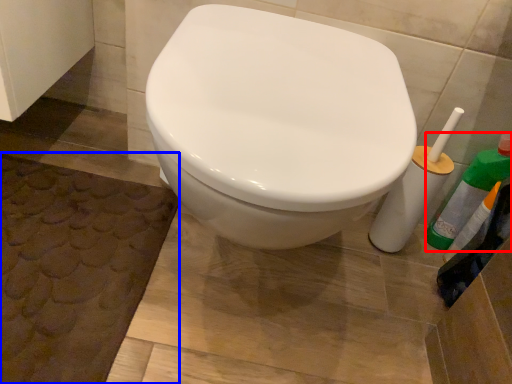
Question: Which of the following is the closest to the observer, cleaning product (highlighted by a red box) or bath mat (highlighted by a blue box)?

Choices:
 (A) cleaning product
 (B) bath mat

Answer: (B)